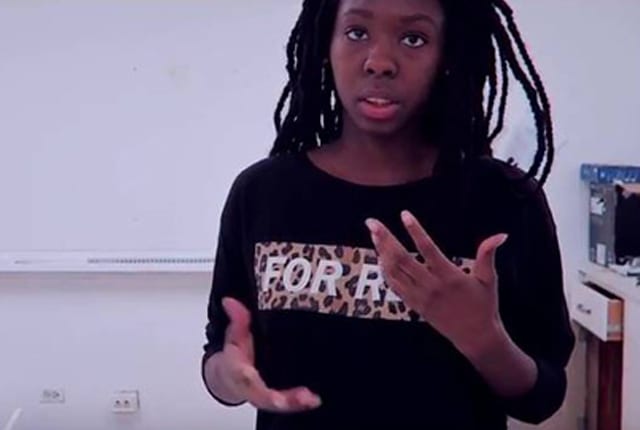
Locate an element on the screen. wall is located at coordinates (109, 150).